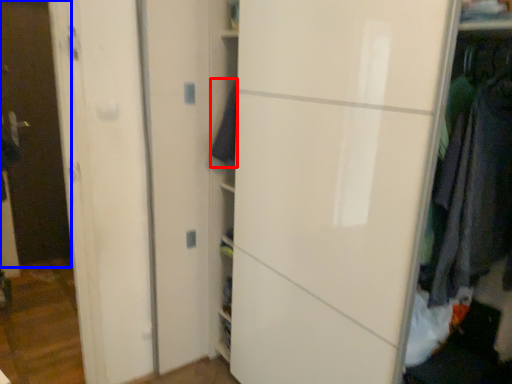
Question: Among these objects, which one is nearest to the camera, clothing (highlighted by a red box) or glass door (highlighted by a blue box)?

Choices:
 (A) clothing
 (B) glass door

Answer: (A)